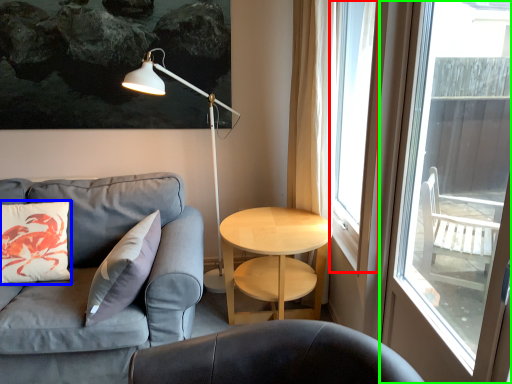
Question: Which is nearer to the window screen (highlighted by a red box)? pillow (highlighted by a blue box) or window (highlighted by a green box).

Choices:
 (A) pillow
 (B) window

Answer: (B)